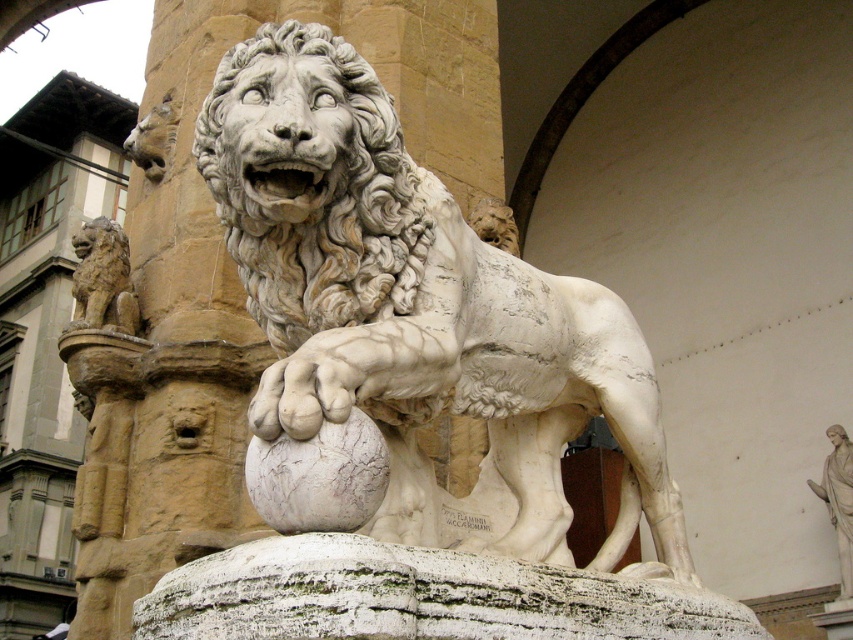
Question: Which point is farther to the camera?

Choices:
 (A) white marble lion at center
 (B) matte stone lion at left
 (C) white marble statue at upper right

Answer: (C)

Question: Does white marble lion at center have a lesser width compared to matte stone lion at left?

Choices:
 (A) yes
 (B) no

Answer: (B)

Question: Is white marble lion at center bigger than white marble statue at upper right?

Choices:
 (A) no
 (B) yes

Answer: (B)

Question: Which object appears farthest from the camera in this image?

Choices:
 (A) matte stone lion at left
 (B) white marble pillar at center
 (C) white marble lion at center
 (D) white marble statue at upper right

Answer: (D)

Question: Considering the relative positions of white marble lion at center and white marble pillar at center in the image provided, where is white marble lion at center located with respect to white marble pillar at center?

Choices:
 (A) above
 (B) below

Answer: (B)

Question: Which object appears farthest from the camera in this image?

Choices:
 (A) white marble statue at upper right
 (B) white marble pillar at center
 (C) white marble lion at center
 (D) matte stone lion at left

Answer: (A)